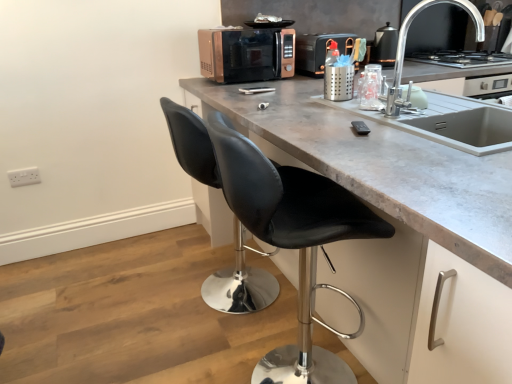
Describe the element at coordinates (405, 45) in the screenshot. I see `silver metallic faucet at upper right` at that location.

What is the approximate width of stainless steel gas stove at upper right?

stainless steel gas stove at upper right is 21.46 inches wide.

Describe the element at coordinates (24, 176) in the screenshot. I see `white plastic electrical outlet at lower left` at that location.

The width and height of the screenshot is (512, 384). I want to click on silver metallic faucet at upper right, so click(x=405, y=45).

Is rose gold metallic toaster at upper center, the second appliance in the right-to-left sequence, far from silver metallic faucet at upper right?

Yes, rose gold metallic toaster at upper center, the second appliance in the right-to-left sequence, and silver metallic faucet at upper right are quite far apart.

Is rose gold metallic toaster at upper center, the 1th appliance viewed from the left, positioned with its back to silver metallic faucet at upper right?

No, rose gold metallic toaster at upper center, the 1th appliance viewed from the left, is not facing away from silver metallic faucet at upper right.

Considering the points (339, 41) and (423, 0), which point is in front, point (339, 41) or point (423, 0)?

The point (339, 41) is closer to the camera.

From a real-world perspective, which object rests below the other?

rose gold metallic toaster at upper center, the 1th appliance viewed from the left, is physically lower.

In the scene shown: In terms of size, does silver metallic faucet at upper right appear bigger or smaller than rose gold metallic toaster at upper center, the 1th appliance viewed from the left?

silver metallic faucet at upper right is smaller than rose gold metallic toaster at upper center, the 1th appliance viewed from the left.

From the picture: Are silver metallic faucet at upper right and rose gold metallic toaster at upper center, the 1th appliance viewed from the left, making contact?

No, silver metallic faucet at upper right is not making contact with rose gold metallic toaster at upper center, the 1th appliance viewed from the left.

Considering the sizes of objects silver metallic faucet at upper right and rose gold metallic toaster at upper center, the 1th appliance viewed from the left, in the image provided, who is wider, silver metallic faucet at upper right or rose gold metallic toaster at upper center, the 1th appliance viewed from the left,?

rose gold metallic toaster at upper center, the 1th appliance viewed from the left, is wider.

From the picture: Is the depth of rose gold metallic microwave at center less than that of metallic silver kettle at upper right, which is the 1th appliance in right-to-left order?

Yes, rose gold metallic microwave at center is closer to the camera.

Locate an element on the screen. The width and height of the screenshot is (512, 384). the 2nd appliance to the right of the rose gold metallic microwave at center, starting your count from the anchor is located at coordinates (384, 46).

Is rose gold metallic microwave at center with metallic silver kettle at upper right, which is the 1th appliance in right-to-left order?

No, rose gold metallic microwave at center is not in contact with metallic silver kettle at upper right, which is the 1th appliance in right-to-left order.

Considering the sizes of objects rose gold metallic microwave at center and metallic silver kettle at upper right, which is the 1th appliance in right-to-left order, in the image provided, who is smaller, rose gold metallic microwave at center or metallic silver kettle at upper right, which is the 1th appliance in right-to-left order,?

Smaller between the two is metallic silver kettle at upper right, which is the 1th appliance in right-to-left order.

Looking at the image, does concrete gray countertop at center seem bigger or smaller compared to rose gold metallic microwave at center?

Considering their sizes, concrete gray countertop at center takes up more space than rose gold metallic microwave at center.

Can you tell me how much concrete gray countertop at center and rose gold metallic microwave at center differ in facing direction?

A: The angular difference between concrete gray countertop at center and rose gold metallic microwave at center is 92.3 degrees.

Which object is thinner, concrete gray countertop at center or rose gold metallic microwave at center?

With smaller width is rose gold metallic microwave at center.

How many degrees apart are the facing directions of silver metallic faucet at upper right and metallic silver kettle at upper right, the second appliance from the left?

40.9 degrees separate the facing orientations of silver metallic faucet at upper right and metallic silver kettle at upper right, the second appliance from the left.

From the picture: Could you tell me if silver metallic faucet at upper right is turned towards metallic silver kettle at upper right, the second appliance from the left?

No.

Which of these two, silver metallic faucet at upper right or metallic silver kettle at upper right, the second appliance from the left, stands shorter?

With less height is metallic silver kettle at upper right, the second appliance from the left.

Is point (203, 140) less distant than point (313, 241)?

No, it is not.

Based on the photo, is black leather swivel chair at center spatially inside black leather stool at center, or outside of it?

black leather swivel chair at center is located beyond the bounds of black leather stool at center.

Considering their positions, is black leather swivel chair at center located in front of or behind black leather stool at center?

black leather swivel chair at center is positioned farther from the viewer than black leather stool at center.

Is black leather swivel chair at center positioned far away from black leather stool at center?

No, black leather swivel chair at center is in close proximity to black leather stool at center.

How different are the orientations of white plastic electrical outlet at lower left and metallic silver kettle at upper right, which is the 1th appliance in right-to-left order, in degrees?

2.98 degrees.

Who is smaller, white plastic electrical outlet at lower left or metallic silver kettle at upper right, which is the 1th appliance in right-to-left order?

Smaller between the two is white plastic electrical outlet at lower left.

From a real-world perspective, who is located lower, white plastic electrical outlet at lower left or metallic silver kettle at upper right, the second appliance from the left?

white plastic electrical outlet at lower left.

Consider the image. Which object is wider, white plastic electrical outlet at lower left or metallic silver kettle at upper right, the second appliance from the left?

Wider between the two is metallic silver kettle at upper right, the second appliance from the left.

At what (x,y) coordinates should I click in order to perform the action: click on tap on the right side of rose gold metallic toaster at upper center, the second appliance in the right-to-left sequence. Please return your answer as a coordinate pair (x, y). The width and height of the screenshot is (512, 384). Looking at the image, I should click on (405, 45).

Where is `appliance on the left of silver metallic faucet at upper right`? The width and height of the screenshot is (512, 384). appliance on the left of silver metallic faucet at upper right is located at coordinates (319, 51).

Which object lies further to the anchor point black leather stool at center, concrete gray countertop at center or rose gold metallic toaster at upper center, the 1th appliance viewed from the left?

Based on the image, rose gold metallic toaster at upper center, the 1th appliance viewed from the left, appears to be further to black leather stool at center.

Considering their positions, is metallic silver kettle at upper right, which is the 1th appliance in right-to-left order, positioned closer to rose gold metallic microwave at center than white plastic electrical outlet at lower left?

metallic silver kettle at upper right, which is the 1th appliance in right-to-left order, is closer to rose gold metallic microwave at center.

When comparing their distances from concrete gray countertop at center, does black leather stool at center or rose gold metallic microwave at center seem further?

Among the two, rose gold metallic microwave at center is located further to concrete gray countertop at center.

Estimate the real-world distances between objects in this image. Which object is further from white plastic electrical outlet at lower left, rose gold metallic toaster at upper center, the 1th appliance viewed from the left, or metallic silver kettle at upper right, which is the 1th appliance in right-to-left order?

metallic silver kettle at upper right, which is the 1th appliance in right-to-left order, is further to white plastic electrical outlet at lower left.

Estimate the real-world distances between objects in this image. Which object is further from black leather swivel chair at center, rose gold metallic toaster at upper center, the second appliance in the right-to-left sequence, or concrete gray countertop at center?

rose gold metallic toaster at upper center, the second appliance in the right-to-left sequence, is further to black leather swivel chair at center.

Which object lies further to the anchor point white plastic electrical outlet at lower left, stainless steel gas stove at upper right or rose gold metallic microwave at center?

stainless steel gas stove at upper right is further to white plastic electrical outlet at lower left.

Looking at the image, which one is located closer to stainless steel gas stove at upper right, white plastic electrical outlet at lower left or rose gold metallic microwave at center?

rose gold metallic microwave at center lies closer to stainless steel gas stove at upper right than the other object.

Based on their spatial positions, is stainless steel gas stove at upper right or white plastic electrical outlet at lower left further from rose gold metallic microwave at center?

white plastic electrical outlet at lower left is further to rose gold metallic microwave at center.

I want to click on microwave oven positioned between concrete gray countertop at center and stainless steel gas stove at upper right from near to far, so (x=246, y=54).

The width and height of the screenshot is (512, 384). I want to click on chair situated between black leather swivel chair at center and silver metallic faucet at upper right from left to right, so click(293, 240).

Where is `chair between concrete gray countertop at center and stainless steel gas stove at upper right from front to back`? The height and width of the screenshot is (384, 512). chair between concrete gray countertop at center and stainless steel gas stove at upper right from front to back is located at coordinates (293, 240).

At what (x,y) coordinates should I click in order to perform the action: click on appliance between black leather swivel chair at center and metallic silver kettle at upper right, which is the 1th appliance in right-to-left order, from front to back. Please return your answer as a coordinate pair (x, y). This screenshot has height=384, width=512. Looking at the image, I should click on (319, 51).